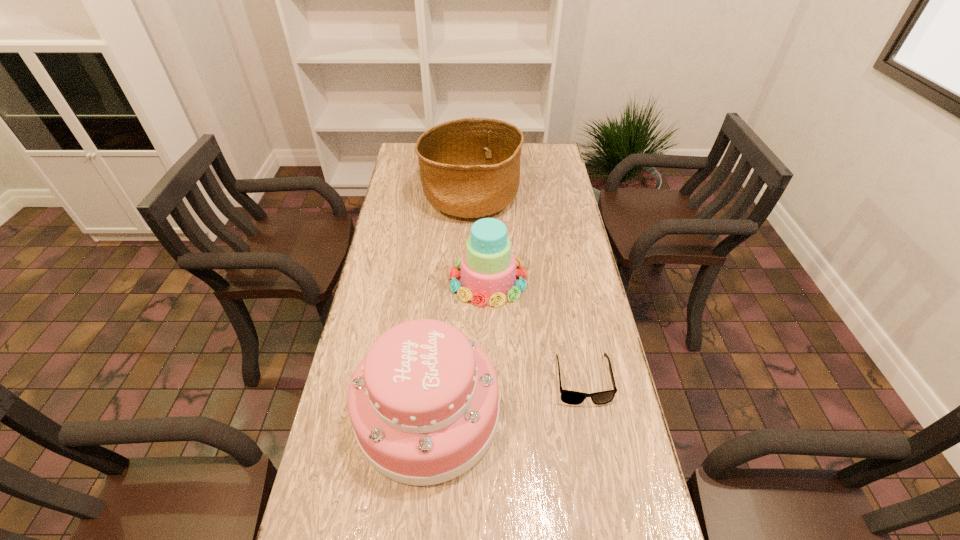
Image resolution: width=960 pixels, height=540 pixels. Find the location of `basket that is at the left edge`. basket that is at the left edge is located at coordinates (469, 168).

Locate an element on the screen. This screenshot has height=540, width=960. cake at the left edge is located at coordinates (424, 402).

At what (x,y) coordinates should I click in order to perform the action: click on object present at the right edge. Please return your answer as a coordinate pair (x, y). The width and height of the screenshot is (960, 540). Looking at the image, I should click on (569, 397).

This screenshot has width=960, height=540. I want to click on object present at the far left corner, so click(x=469, y=168).

Identify the location of vacant space at the left edge of the desktop. The width and height of the screenshot is (960, 540). (410, 265).

At what (x,y) coordinates should I click in order to perform the action: click on vacant region at the right edge of the desktop. Please return your answer as a coordinate pair (x, y). This screenshot has width=960, height=540. Looking at the image, I should click on [x=548, y=173].

Find the location of a particular element. Image resolution: width=960 pixels, height=540 pixels. free space at the far right corner of the desktop is located at coordinates 540,153.

The image size is (960, 540). I want to click on unoccupied area between the shortest object and the nearer cake, so click(x=505, y=396).

This screenshot has width=960, height=540. In order to click on free area in between the sunglasses and the nearer cake in this screenshot , I will do `click(505, 396)`.

Locate an element on the screen. This screenshot has height=540, width=960. free spot between the nearer cake and the farthest object is located at coordinates (449, 305).